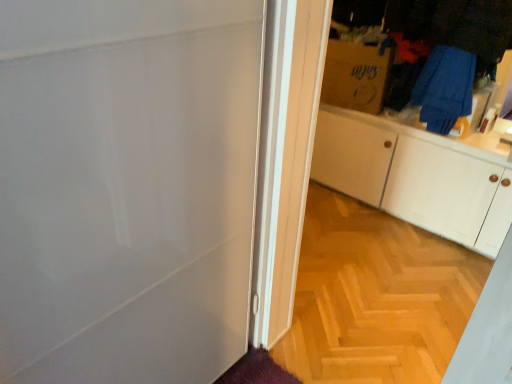
Question: From the image's perspective, does blue fabric laundry at upper right, the first laundry in the bottom-to-top sequence, appear higher than brown cardboard box at upper right?

Choices:
 (A) no
 (B) yes

Answer: (A)

Question: From a real-world perspective, is blue fabric laundry at upper right, the second laundry positioned from the top, physically above brown cardboard box at upper right?

Choices:
 (A) yes
 (B) no

Answer: (B)

Question: Can you confirm if blue fabric laundry at upper right, the first laundry in the bottom-to-top sequence, is wider than brown cardboard box at upper right?

Choices:
 (A) yes
 (B) no

Answer: (A)

Question: Is blue fabric laundry at upper right, the second laundry positioned from the top, taller than brown cardboard box at upper right?

Choices:
 (A) yes
 (B) no

Answer: (B)

Question: Does blue fabric laundry at upper right, the second laundry positioned from the top, appear on the right side of brown cardboard box at upper right?

Choices:
 (A) yes
 (B) no

Answer: (A)

Question: Considering the relative sizes of blue fabric laundry at upper right, the first laundry in the bottom-to-top sequence, and brown cardboard box at upper right in the image provided, is blue fabric laundry at upper right, the first laundry in the bottom-to-top sequence, thinner than brown cardboard box at upper right?

Choices:
 (A) yes
 (B) no

Answer: (B)

Question: Is blue fabric at upper right, which is the 2th laundry from bottom to top, behind blue fabric laundry at upper right, the first laundry in the bottom-to-top sequence?

Choices:
 (A) no
 (B) yes

Answer: (A)

Question: Are blue fabric at upper right, which is the 2th laundry from bottom to top, and blue fabric laundry at upper right, the second laundry positioned from the top, beside each other?

Choices:
 (A) yes
 (B) no

Answer: (A)

Question: Does blue fabric at upper right, which is the 2th laundry from bottom to top, have a larger size compared to blue fabric laundry at upper right, the first laundry in the bottom-to-top sequence?

Choices:
 (A) no
 (B) yes

Answer: (B)

Question: Considering the relative sizes of blue fabric at upper right, which is counted as the 1th laundry, starting from the top, and blue fabric laundry at upper right, the first laundry in the bottom-to-top sequence, in the image provided, is blue fabric at upper right, which is counted as the 1th laundry, starting from the top, wider than blue fabric laundry at upper right, the first laundry in the bottom-to-top sequence,?

Choices:
 (A) yes
 (B) no

Answer: (A)

Question: Would you say blue fabric at upper right, which is counted as the 1th laundry, starting from the top, is outside blue fabric laundry at upper right, the first laundry in the bottom-to-top sequence?

Choices:
 (A) yes
 (B) no

Answer: (A)

Question: From the image's perspective, would you say blue fabric at upper right, which is the 2th laundry from bottom to top, is shown under blue fabric laundry at upper right, the second laundry positioned from the top?

Choices:
 (A) yes
 (B) no

Answer: (B)

Question: Can you confirm if wooden floor at center is smaller than blue fabric at upper right, which is counted as the 1th laundry, starting from the top?

Choices:
 (A) no
 (B) yes

Answer: (B)